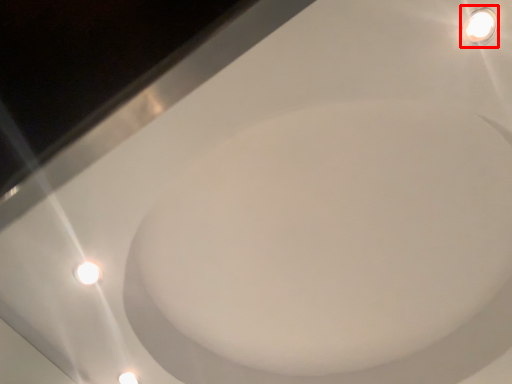
Question: From the image's perspective, where is light fixture (annotated by the red box) located relative to bath?

Choices:
 (A) below
 (B) above

Answer: (B)